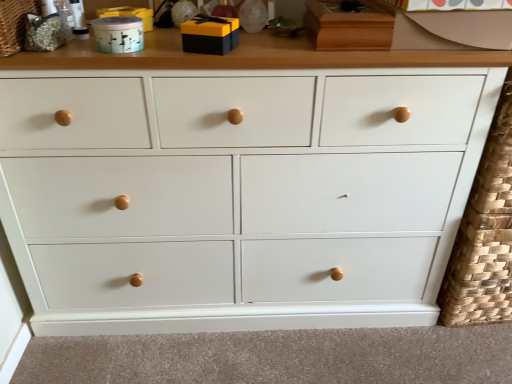
Find the location of a particular element. unoccupied region to the right of matte black gift box at upper center, acting as the second toy starting from the left is located at coordinates (284, 57).